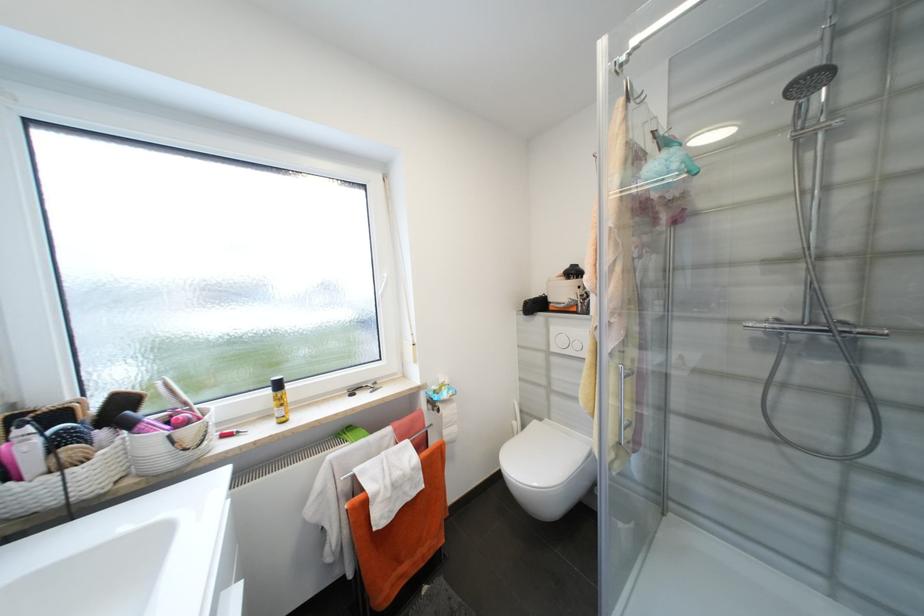
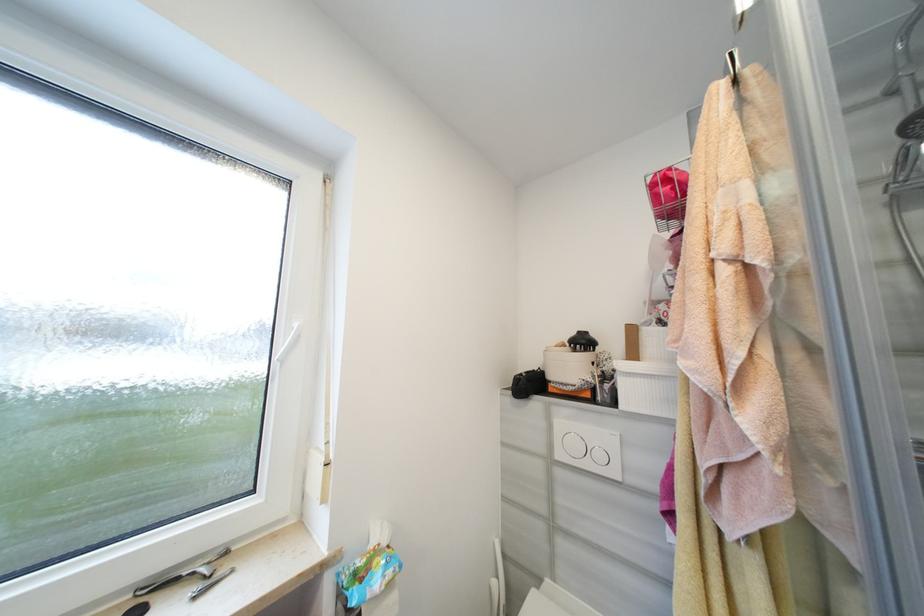
Question: The first image is from the beginning of the video and the second image is from the end. How did the camera likely rotate when shooting the video?

Choices:
 (A) Left
 (B) Right
 (C) Up
 (D) Down

Answer: (C)